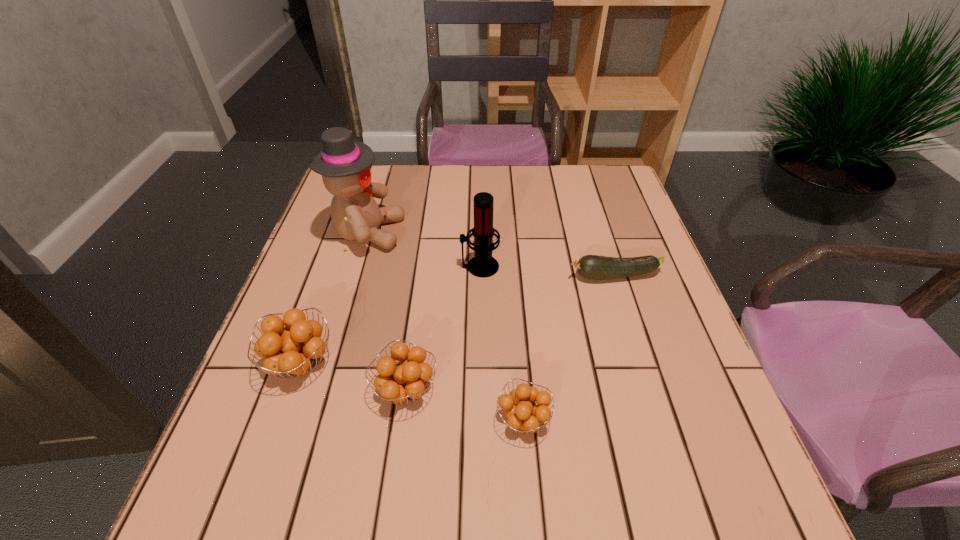
The image size is (960, 540). Find the location of `the second closest orange fruit relative to the microphone`. the second closest orange fruit relative to the microphone is located at coordinates (293, 349).

This screenshot has height=540, width=960. Find the location of `orange fruit that can be found as the closest to the shortest orange fruit`. orange fruit that can be found as the closest to the shortest orange fruit is located at coordinates (401, 383).

You are a GUI agent. You are given a task and a screenshot of the screen. Output one action in this format:
    pyautogui.click(x=<x>, y=<y>)
    Task: Click on the free space that satisfies the following two spatial constraints: 1. at the blossom end of the shortest object; 2. on the front side of the third object from left to right
    
    Given the screenshot: What is the action you would take?
    pyautogui.click(x=651, y=389)

Locate an element on the screen. vacant space that satisfies the following two spatial constraints: 1. on the front-facing side of the rag_doll; 2. on the right side of the microphone is located at coordinates (358, 267).

The image size is (960, 540). I want to click on free spot that satisfies the following two spatial constraints: 1. on the front-facing side of the rag_doll; 2. on the left side of the microphone, so click(x=358, y=267).

I want to click on blank area in the image that satisfies the following two spatial constraints: 1. on the front-facing side of the microphone; 2. on the left side of the tallest object, so click(x=358, y=267).